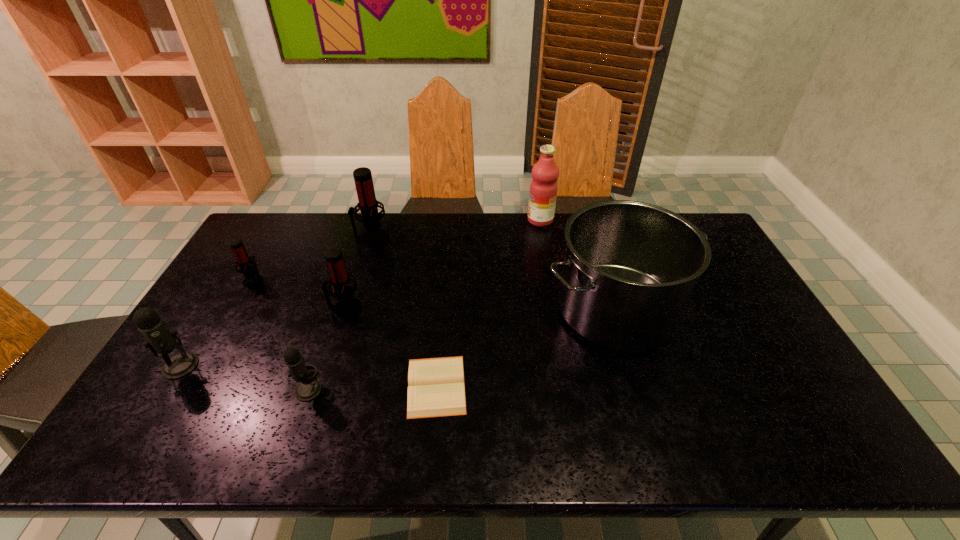
Locate an element on the screen. the right black microphone is located at coordinates (309, 388).

The image size is (960, 540). Find the location of `the sixth object from left to right`. the sixth object from left to right is located at coordinates (436, 388).

At what (x,y) coordinates should I click in order to perform the action: click on the shortest object. Please return your answer as a coordinate pair (x, y). The height and width of the screenshot is (540, 960). Looking at the image, I should click on (436, 388).

Find the location of a particular element. The height and width of the screenshot is (540, 960). free space located 0.300m on the label of the pink fruit juice is located at coordinates (448, 220).

Find the location of a particular element. The height and width of the screenshot is (540, 960). blank space located on the label of the pink fruit juice is located at coordinates (512, 220).

Identify the location of vacant space situated 0.310m on the label of the pink fruit juice. Image resolution: width=960 pixels, height=540 pixels. (445, 220).

Where is `vacant area situated on the right of the farthest microphone`? vacant area situated on the right of the farthest microphone is located at coordinates (461, 238).

I want to click on vacant region located 0.190m on the back of the saucepan, so click(x=592, y=235).

Find the location of a particular element. This screenshot has height=540, width=960. free location located on the left of the third nearest microphone is located at coordinates (228, 308).

You are a GUI agent. You are given a task and a screenshot of the screen. Output one action in this format:
    pyautogui.click(x=<x>, y=<y>)
    Task: Click on the vacant region located on the right of the left black microphone
    The height and width of the screenshot is (540, 960).
    Given the screenshot: What is the action you would take?
    pyautogui.click(x=329, y=366)